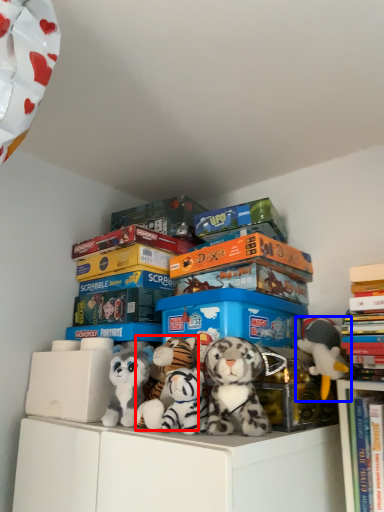
Question: Which of the following is the farthest to the observer, toy (highlighted by a red box) or toy (highlighted by a blue box)?

Choices:
 (A) toy
 (B) toy

Answer: (B)